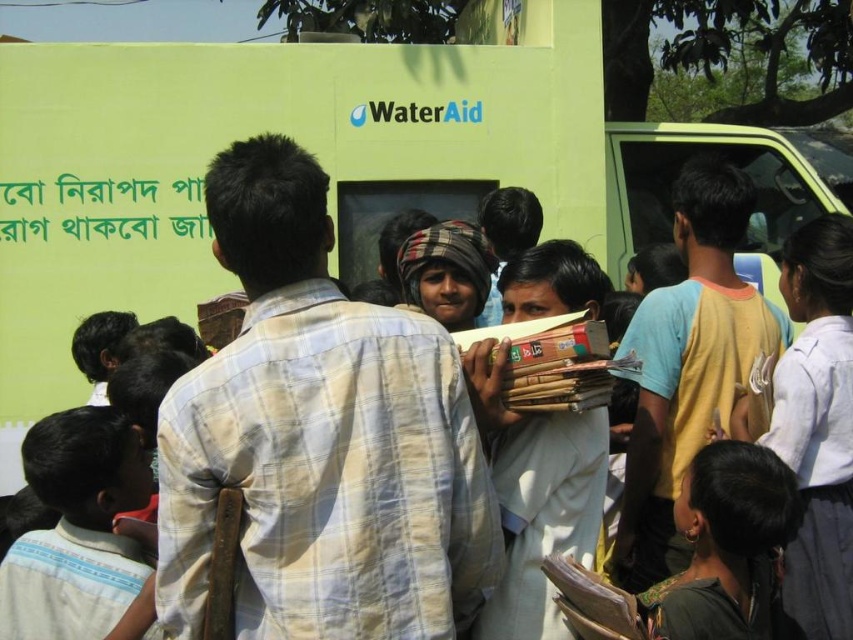
Question: Which object is positioned farthest from the light beige plaid shirt at center?

Choices:
 (A) dark brown fabric headscarf at lower right
 (B) white cotton shirt at lower left

Answer: (A)

Question: Which of the following is the closest to the observer?

Choices:
 (A) (125, 420)
 (B) (704, 445)

Answer: (A)

Question: Is light beige plaid shirt at center smaller than dark brown fabric headscarf at lower right?

Choices:
 (A) no
 (B) yes

Answer: (A)

Question: Does light beige plaid shirt at center appear over dark brown fabric headscarf at lower right?

Choices:
 (A) no
 (B) yes

Answer: (B)

Question: Can you confirm if white cotton shirt at lower left is positioned below dark brown fabric headscarf at lower right?

Choices:
 (A) yes
 (B) no

Answer: (B)

Question: Which object is positioned farthest from the dark brown fabric headscarf at lower right?

Choices:
 (A) white cotton shirt at lower left
 (B) light beige plaid shirt at center

Answer: (A)